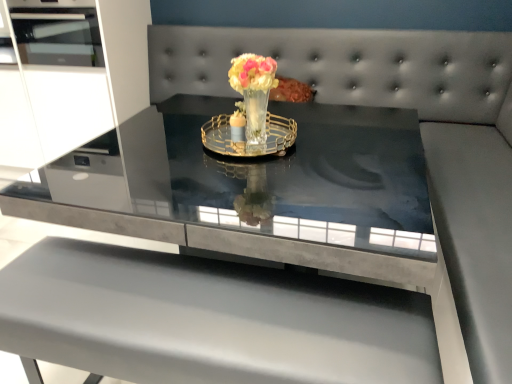
Question: From a real-world perspective, is translucent glass vase at center positioned under matte gray table at center based on gravity?

Choices:
 (A) yes
 (B) no

Answer: (B)

Question: Considering the relative sizes of translucent glass vase at center and matte gray table at center in the image provided, is translucent glass vase at center bigger than matte gray table at center?

Choices:
 (A) yes
 (B) no

Answer: (B)

Question: Is the surface of translucent glass vase at center in direct contact with matte gray table at center?

Choices:
 (A) no
 (B) yes

Answer: (A)

Question: Is translucent glass vase at center to the left of matte gray table at center from the viewer's perspective?

Choices:
 (A) yes
 (B) no

Answer: (B)

Question: Can you confirm if translucent glass vase at center is positioned to the right of matte gray table at center?

Choices:
 (A) yes
 (B) no

Answer: (A)

Question: Is matte gray table at center located within translucent glass vase at center?

Choices:
 (A) no
 (B) yes

Answer: (A)

Question: From the image's perspective, does translucent glass vase at center appear higher than gold metallic tray at center?

Choices:
 (A) yes
 (B) no

Answer: (A)

Question: From the image's perspective, is translucent glass vase at center below gold metallic tray at center?

Choices:
 (A) no
 (B) yes

Answer: (A)

Question: From a real-world perspective, is translucent glass vase at center physically above gold metallic tray at center?

Choices:
 (A) no
 (B) yes

Answer: (B)

Question: Does translucent glass vase at center touch gold metallic tray at center?

Choices:
 (A) yes
 (B) no

Answer: (A)

Question: Is the position of translucent glass vase at center more distant than that of gold metallic tray at center?

Choices:
 (A) yes
 (B) no

Answer: (B)

Question: Can you confirm if translucent glass vase at center is bigger than gold metallic tray at center?

Choices:
 (A) yes
 (B) no

Answer: (A)

Question: Can you confirm if gold metallic tray at center is wider than matte gray table at center?

Choices:
 (A) yes
 (B) no

Answer: (B)